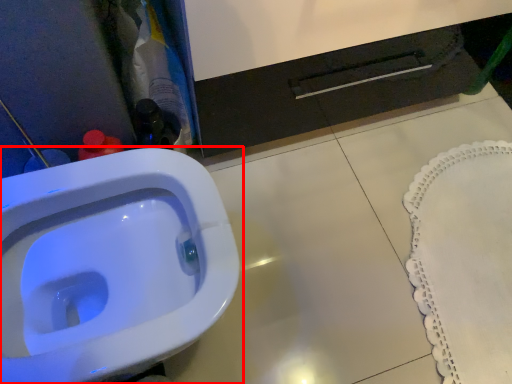
Question: Observing the image, what is the correct spatial positioning of toilet (annotated by the red box) in reference to bath mat?

Choices:
 (A) right
 (B) left

Answer: (B)